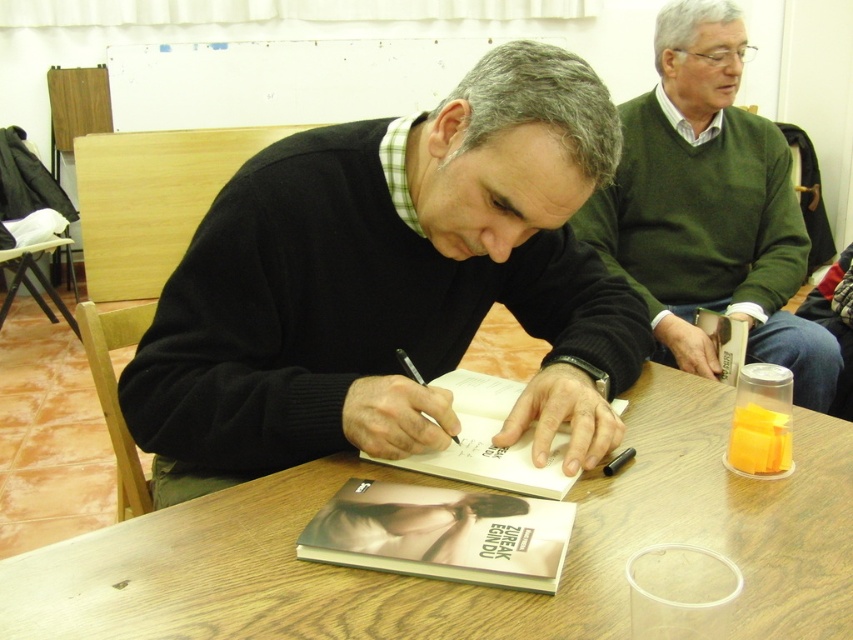
Question: In this image, where is soft matte cover at center located relative to black paper at center?

Choices:
 (A) above
 (B) below

Answer: (B)

Question: Which point is closer to the camera taking this photo?

Choices:
 (A) (495, 451)
 (B) (698, 184)
 (C) (486, 529)
 (D) (724, 497)

Answer: (C)

Question: Is green sweater at center to the right of white paper notebook at center from the viewer's perspective?

Choices:
 (A) yes
 (B) no

Answer: (A)

Question: Which point is farther from the camera taking this photo?

Choices:
 (A) (527, 474)
 (B) (471, 448)
 (C) (598, 524)

Answer: (B)

Question: Is black sweater at center to the left of wooden table at center from the viewer's perspective?

Choices:
 (A) no
 (B) yes

Answer: (B)

Question: Which of the following is the farthest from the observer?

Choices:
 (A) (480, 440)
 (B) (780, 193)
 (C) (640, 452)
 (D) (509, 577)

Answer: (B)